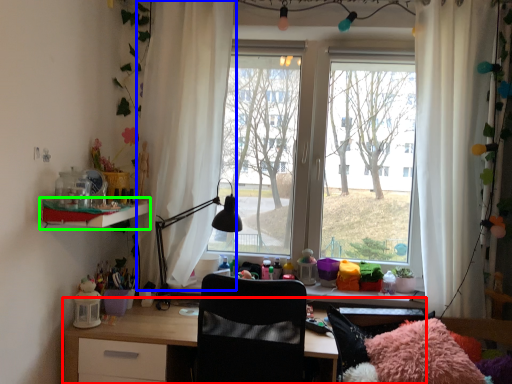
Question: Which object is positioned farthest from desk (highlighted by a red box)? Select from curtain (highlighted by a blue box) and shelf (highlighted by a green box).

Choices:
 (A) curtain
 (B) shelf

Answer: (A)